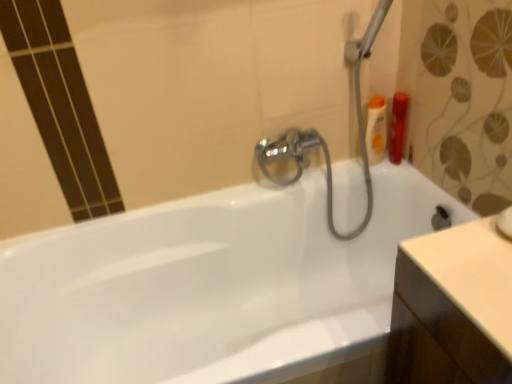
Question: From a real-world perspective, is white glossy bathtub at center on top of matte orange bottle at upper right, which ranks as the 2th toiletry in left-to-right order?

Choices:
 (A) yes
 (B) no

Answer: (B)

Question: Does white glossy bathtub at center appear on the right side of matte orange bottle at upper right, which ranks as the 2th toiletry in left-to-right order?

Choices:
 (A) yes
 (B) no

Answer: (B)

Question: Is white glossy bathtub at center positioned far away from matte orange bottle at upper right, which ranks as the 2th toiletry in left-to-right order?

Choices:
 (A) yes
 (B) no

Answer: (B)

Question: Is white glossy bathtub at center further to the viewer compared to matte orange bottle at upper right, arranged as the first toiletry when viewed from the right?

Choices:
 (A) yes
 (B) no

Answer: (B)

Question: From a real-world perspective, does white glossy bathtub at center sit lower than matte orange bottle at upper right, which ranks as the 2th toiletry in left-to-right order?

Choices:
 (A) yes
 (B) no

Answer: (A)

Question: Relative to matte orange bottle at upper right, which ranks as the 2th toiletry in left-to-right order, is white glossy bathtub at center in front or behind?

Choices:
 (A) front
 (B) behind

Answer: (A)

Question: From the image's perspective, is white glossy bathtub at center above or below matte orange bottle at upper right, which ranks as the 2th toiletry in left-to-right order?

Choices:
 (A) below
 (B) above

Answer: (A)

Question: Is white glossy bathtub at center taller or shorter than matte orange bottle at upper right, which ranks as the 2th toiletry in left-to-right order?

Choices:
 (A) tall
 (B) short

Answer: (A)

Question: Considering the positions of point (116, 294) and point (393, 109), is point (116, 294) closer or farther from the camera than point (393, 109)?

Choices:
 (A) closer
 (B) farther

Answer: (A)

Question: In terms of width, does translucent orange bottle at upper right, the 1th toiletry in the left-to-right sequence, look wider or thinner when compared to matte orange bottle at upper right, arranged as the first toiletry when viewed from the right?

Choices:
 (A) thin
 (B) wide

Answer: (A)

Question: Would you say translucent orange bottle at upper right, which ranks as the second toiletry in right-to-left order, is inside or outside matte orange bottle at upper right, arranged as the first toiletry when viewed from the right?

Choices:
 (A) inside
 (B) outside

Answer: (B)

Question: From a real-world perspective, is translucent orange bottle at upper right, which ranks as the second toiletry in right-to-left order, positioned above or below matte orange bottle at upper right, which ranks as the 2th toiletry in left-to-right order?

Choices:
 (A) below
 (B) above

Answer: (B)

Question: Considering the positions of translucent orange bottle at upper right, which ranks as the second toiletry in right-to-left order, and matte orange bottle at upper right, arranged as the first toiletry when viewed from the right, in the image, is translucent orange bottle at upper right, which ranks as the second toiletry in right-to-left order, taller or shorter than matte orange bottle at upper right, arranged as the first toiletry when viewed from the right,?

Choices:
 (A) tall
 (B) short

Answer: (A)

Question: Based on their sizes in the image, would you say white glossy bathtub at center is bigger or smaller than translucent orange bottle at upper right, the 1th toiletry in the left-to-right sequence?

Choices:
 (A) big
 (B) small

Answer: (A)

Question: Is white glossy bathtub at center taller or shorter than translucent orange bottle at upper right, which ranks as the second toiletry in right-to-left order?

Choices:
 (A) tall
 (B) short

Answer: (A)